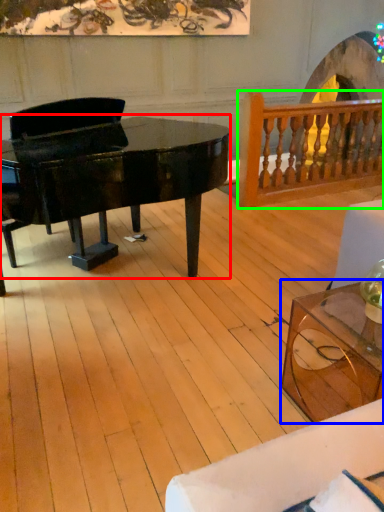
Question: Which object is positioned closest to piano (highlighted by a red box)? Select from coffee table (highlighted by a blue box) and rail (highlighted by a green box).

Choices:
 (A) coffee table
 (B) rail

Answer: (A)